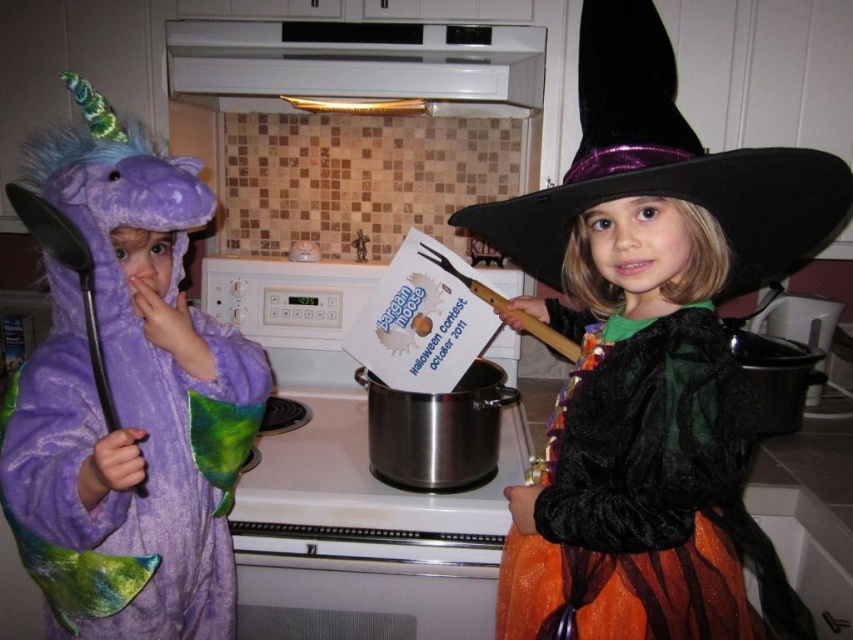
Question: Which object is the closest to the orange tulle dress at right?

Choices:
 (A) purple plush unicorn at left
 (B) black velvet witch hat at upper right
 (C) velvet orange dress at center

Answer: (C)

Question: Which point is closer to the camera?

Choices:
 (A) orange tulle dress at right
 (B) purple plush unicorn at left

Answer: (B)

Question: Which point is farther to the camera?

Choices:
 (A) (834, 230)
 (B) (581, 378)

Answer: (A)

Question: Observing the image, what is the correct spatial positioning of orange tulle dress at right in reference to black velvet witch hat at upper right?

Choices:
 (A) left
 (B) right

Answer: (A)

Question: Is purple plush unicorn at left bigger than orange tulle dress at right?

Choices:
 (A) no
 (B) yes

Answer: (B)

Question: Does velvet orange dress at center appear on the left side of orange tulle dress at right?

Choices:
 (A) yes
 (B) no

Answer: (B)